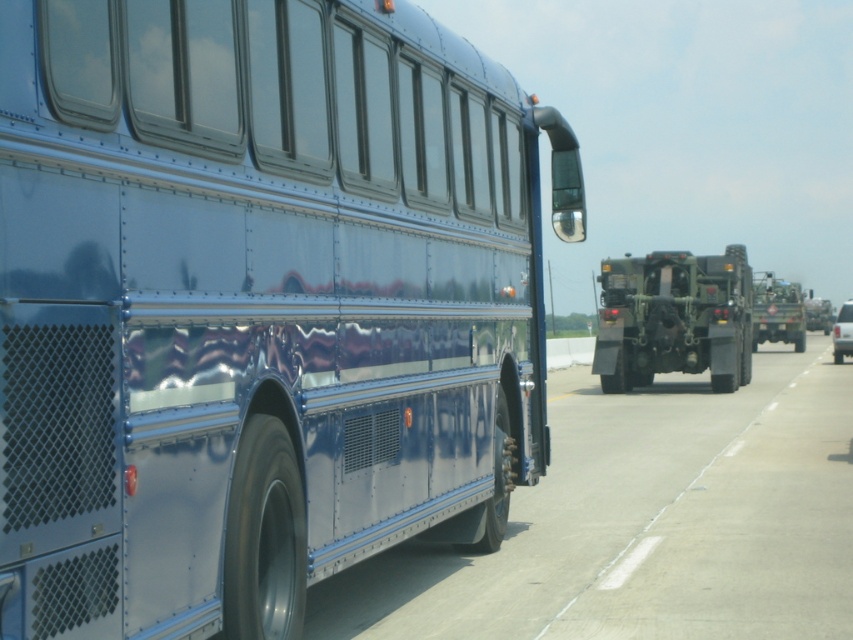
Which is more to the left, glossy blue bus at center or matte green military vehicle at center?

From the viewer's perspective, glossy blue bus at center appears more on the left side.

What do you see at coordinates (256, 304) in the screenshot? I see `glossy blue bus at center` at bounding box center [256, 304].

Measure the distance between point (102, 186) and camera.

A distance of 3.43 meters exists between point (102, 186) and camera.

The image size is (853, 640). What are the coordinates of `glossy blue bus at center` in the screenshot? It's located at (256, 304).